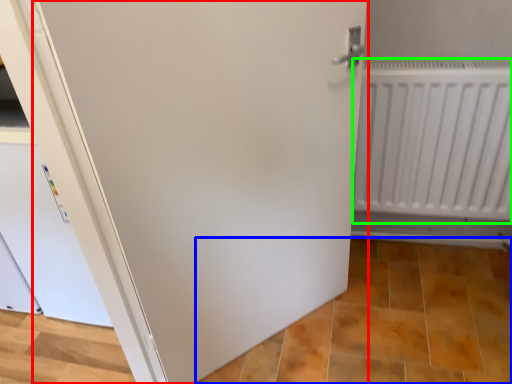
Question: Considering the real-world distances, which object is closest to door (highlighted by a red box)? tile (highlighted by a blue box) or radiator (highlighted by a green box).

Choices:
 (A) tile
 (B) radiator

Answer: (B)